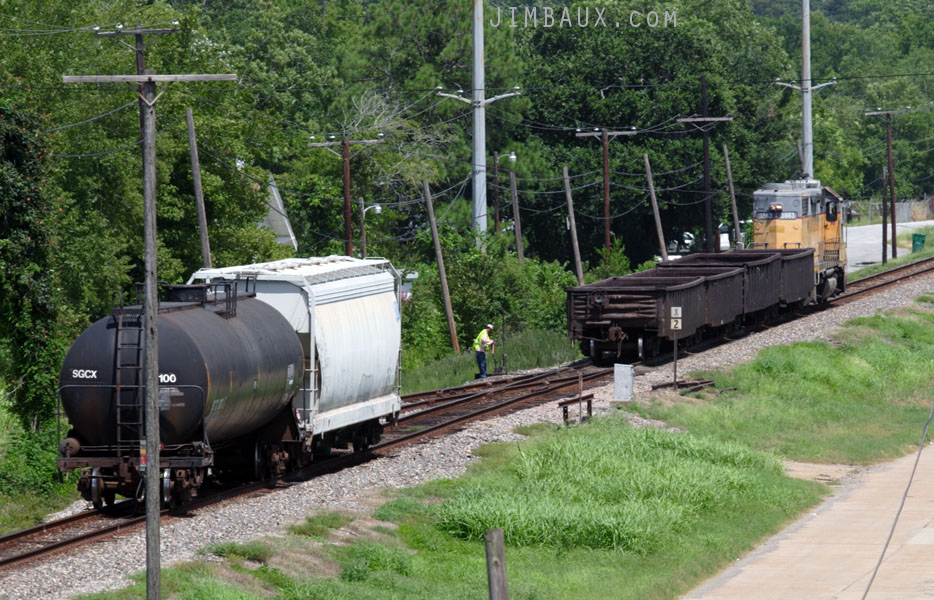
In order to click on trash can in this screenshot , I will do `click(917, 238)`.